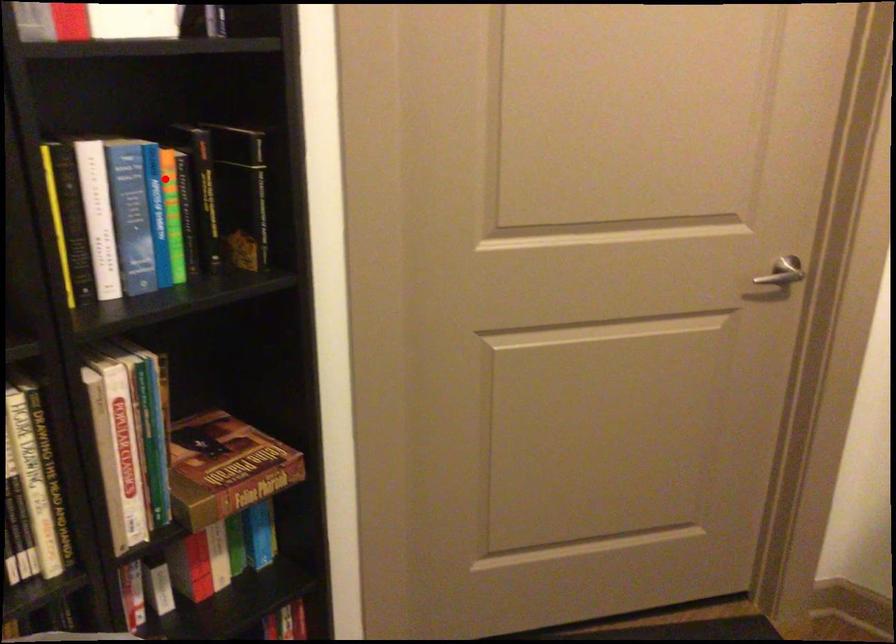
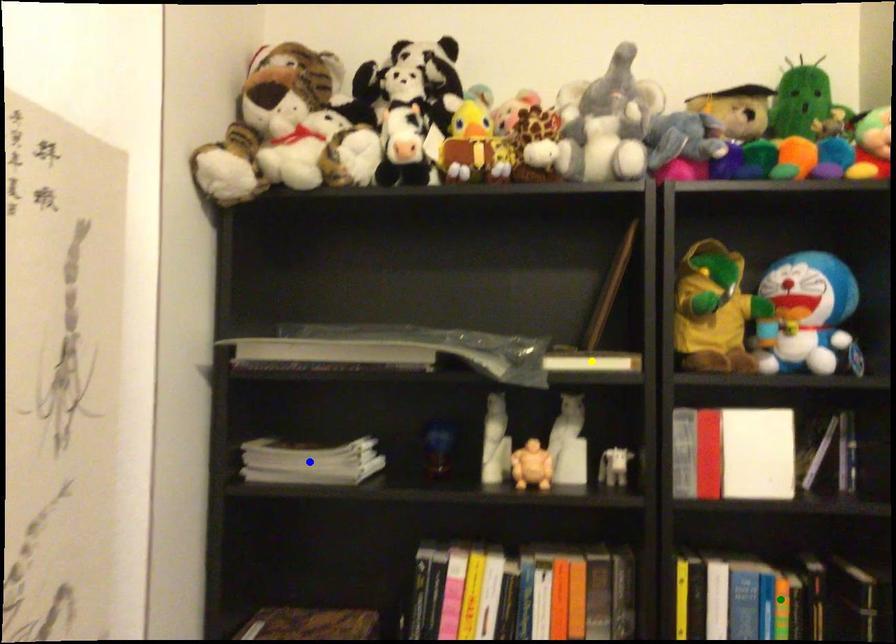
Question: I am providing you with two images of the same scene from different viewpoints. A red point is marked on the first image. You are given multiple points on the second image. Can you choose the point in image 2 that corresponds to the point in image 1?

Choices:
 (A) blue point
 (B) yellow point
 (C) green point

Answer: (C)